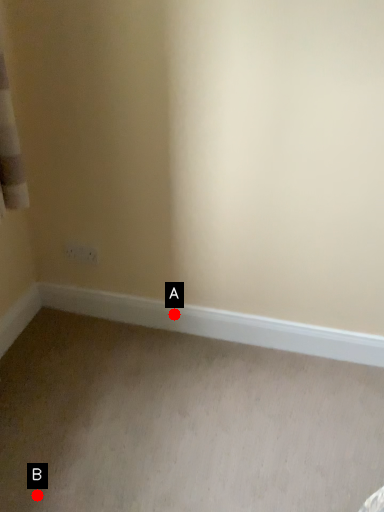
Question: Two points are circled on the image, labeled by A and B beside each circle. Which point appears farthest from the camera in this image?

Choices:
 (A) A is further
 (B) B is further

Answer: (A)